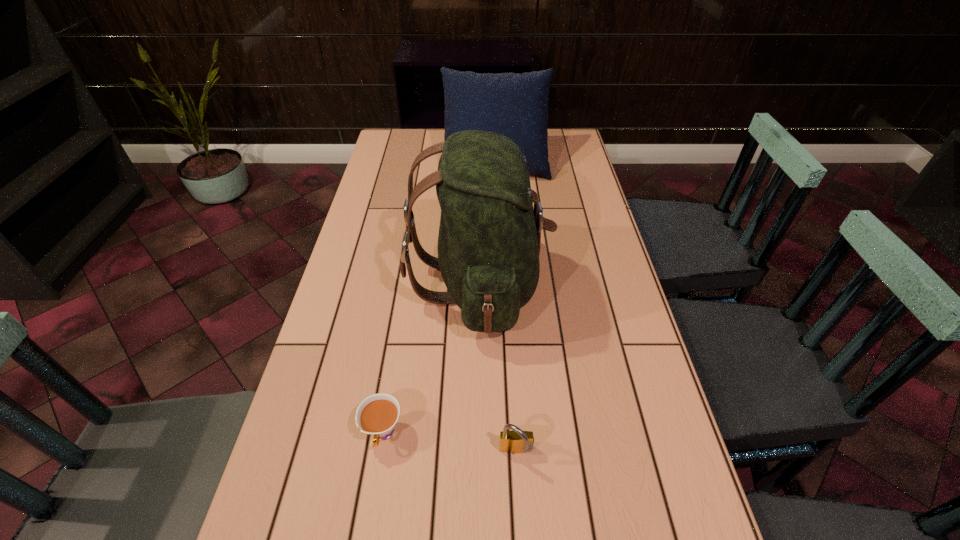
At what (x,y) coordinates should I click in order to perform the action: click on backpack. Please return your answer as a coordinate pair (x, y). Looking at the image, I should click on (489, 239).

This screenshot has height=540, width=960. Identify the location of the second farthest object. (489, 239).

Where is `the farthest object`? The height and width of the screenshot is (540, 960). the farthest object is located at coordinates [515, 105].

Where is `the third shortest object`? The image size is (960, 540). the third shortest object is located at coordinates (515, 105).

In order to click on the second shortest object in this screenshot , I will do `click(516, 441)`.

Locate an element on the screen. The width and height of the screenshot is (960, 540). the shortest object is located at coordinates (377, 415).

Locate an element on the screen. free space located on the open flap of the second farthest object is located at coordinates (570, 284).

Identify the location of free space located on the facing side of the cushion. (500, 258).

Where is `vacant area located 0.080m on the side with the combination dials of the padlock`? This screenshot has width=960, height=540. vacant area located 0.080m on the side with the combination dials of the padlock is located at coordinates (519, 508).

Locate an element on the screen. free space located 0.100m on the side of the shortest object with the handle is located at coordinates pos(371,512).